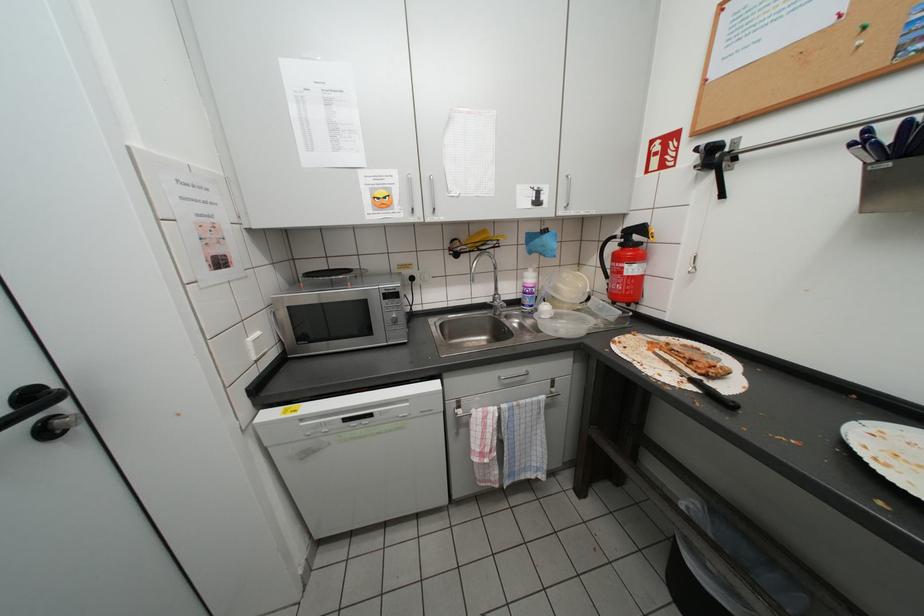
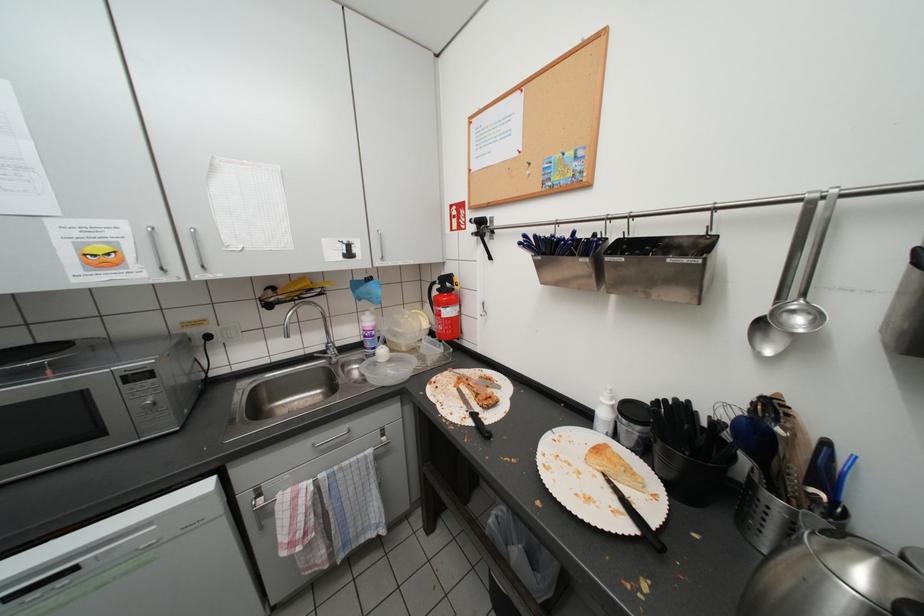
Question: Which direction would the cameraman need to move to produce the second image? Reply with the corresponding letter.

Choices:
 (A) Left
 (B) Right
 (C) Forward
 (D) Backward

Answer: (B)